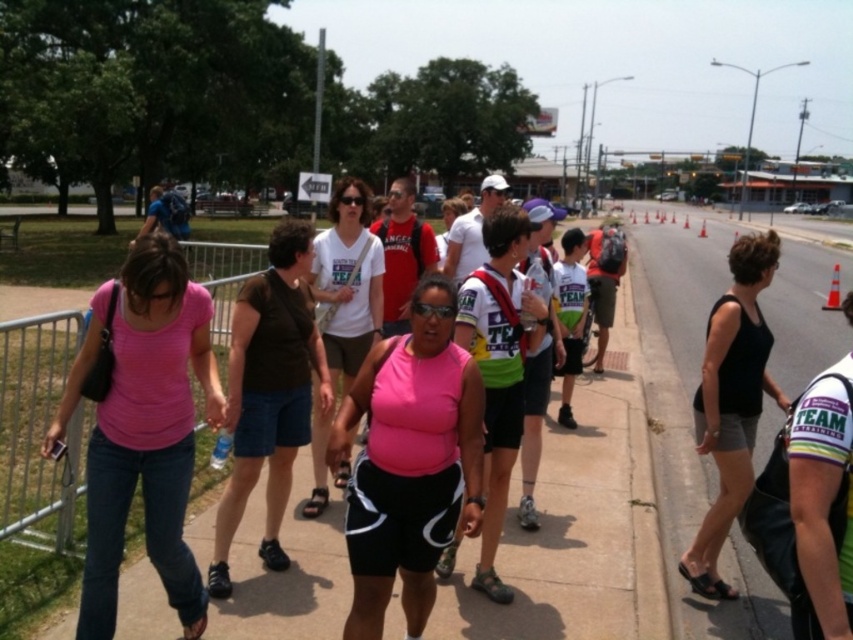
You are a photographer trying to capture a clear shot of the pink matte shirt at center and the pink matte tank top at center. Since both are in the center, how can you distinguish which one is taller?

The pink matte shirt at center is taller than the pink matte tank top at center, so you can identify the taller one as the pink matte shirt at center.

You are a photographer standing at the sidewalk edge. You want to take a photo of the pink matte shirt at center without the orange traffic cone at right blocking it. Can you adjust your angle to achieve this?

The pink matte shirt at center is positioned under the orange traffic cone at right, so adjusting your angle to look downward might allow you to capture the pink matte shirt at center without the traffic cone blocking it.